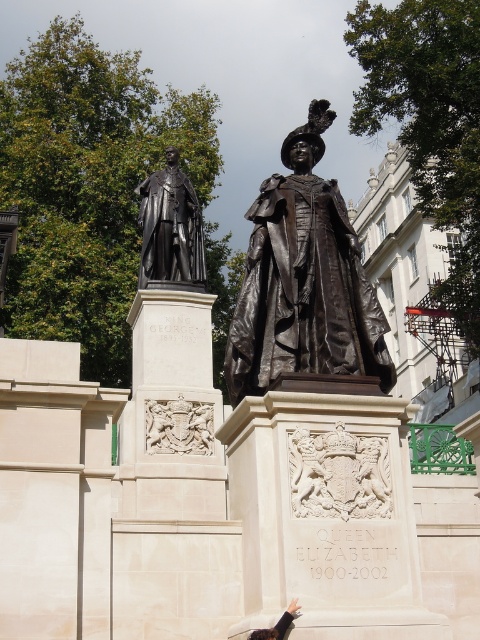
From the picture: You are an art student observing the scene. You need to sketch both the bronze statue at center and the black leather glove at lower center. Which object should you draw first if you want to start with the larger one?

The bronze statue at center is bigger than the black leather glove at lower center, so you should draw the bronze statue at center first.

You are a tourist visiting the public square and see the bronze statue at center and the black leather glove at lower center. Which object is located to the right of the other?

The bronze statue at center is positioned on the right side of black leather glove at lower center, so the bronze statue at center is to the right of the black leather glove at lower center.